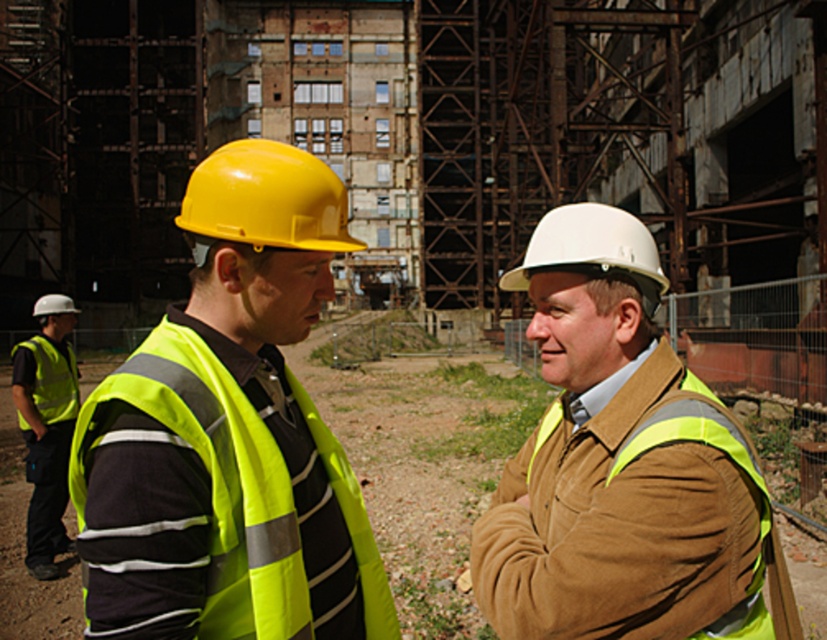
You are a safety inspector observing two workers at a construction site. You notice both are wearing high visibility vests. However, one is labeled as high visibility vest at left and the other as high visibility fabric safety vest at left. Based on their positions, which one is more to the left?

The high visibility vest at left is more to the left because it is positioned on the left side of the high visibility fabric safety vest at left.

You are a safety inspector at the construction site. You need to check the high visibility vest at left located at point (46, 426). Can you confirm if the vest is properly positioned over the clothing?

The high visibility vest at left is properly positioned over the clothing as it is worn over the dark long sleeved shirt with horizontal white stripes.